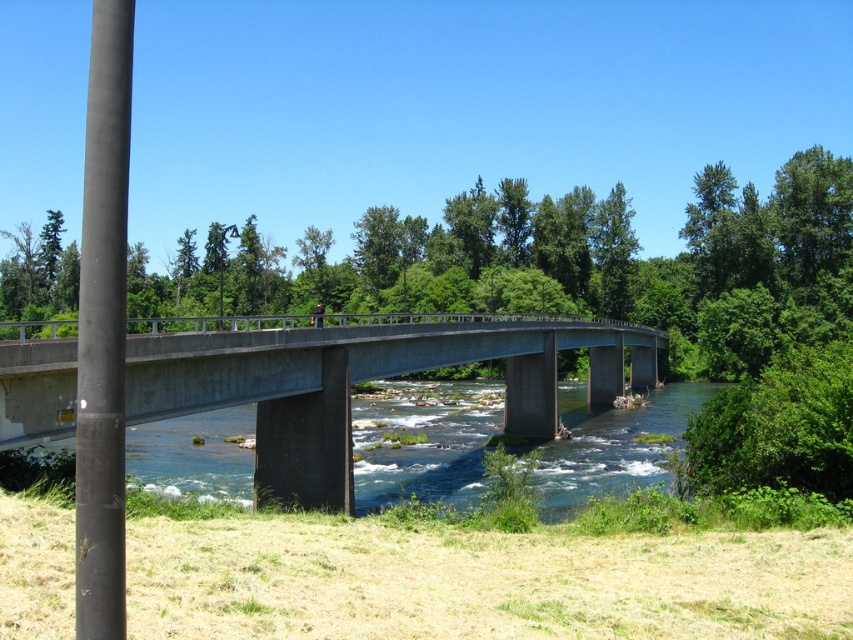
Does concrete bridge at center appear over smooth black pole at left?

No.

Is point (50, 406) in front of point (91, 256)?

No, it is behind (91, 256).

This screenshot has width=853, height=640. What are the coordinates of `concrete bridge at center` in the screenshot? It's located at (358, 381).